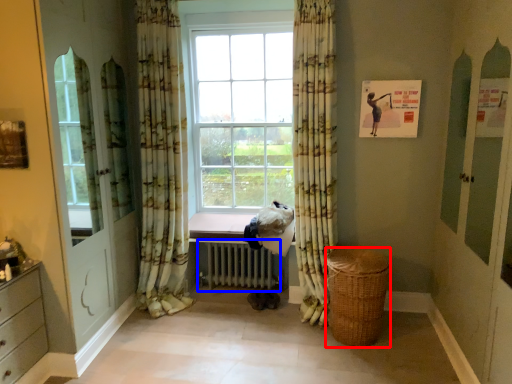
Question: Which object is further to the camera taking this photo, basket (highlighted by a red box) or radiator (highlighted by a blue box)?

Choices:
 (A) basket
 (B) radiator

Answer: (B)